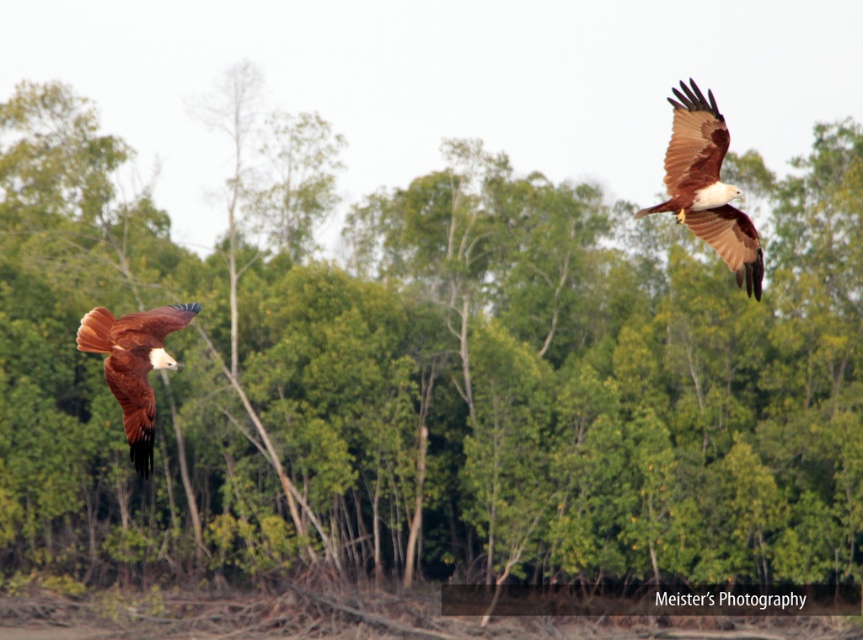
You are a birdwatcher observing two birds in the sky. You see the brown feathered eagle at upper right and the rusty brown feathers at left. Which bird is flying higher?

The brown feathered eagle at upper right is flying higher than the rusty brown feathers at left because it is located above them according to the description.

You are a birdwatcher trying to locate the brown feathered eagle at upper right in the image. What are the coordinates of its position?

The coordinates of the brown feathered eagle at upper right are at point (707, 186).

You are a photographer aiming to capture a closeup shot of the Brahminy Kites in the image. You are currently positioned at the camera location. There is a specific point at coordinates point (746, 280) that you need to focus on. Considering the distance between your current position and this point, can you estimate whether you can capture the Brahminy Kites clearly without needing to move closer?

The point (746, 280) is 391.31 feet away from the camera. Since this distance is quite far, capturing the Brahminy Kites clearly at this point would require a telephoto lens to avoid needing to move closer.